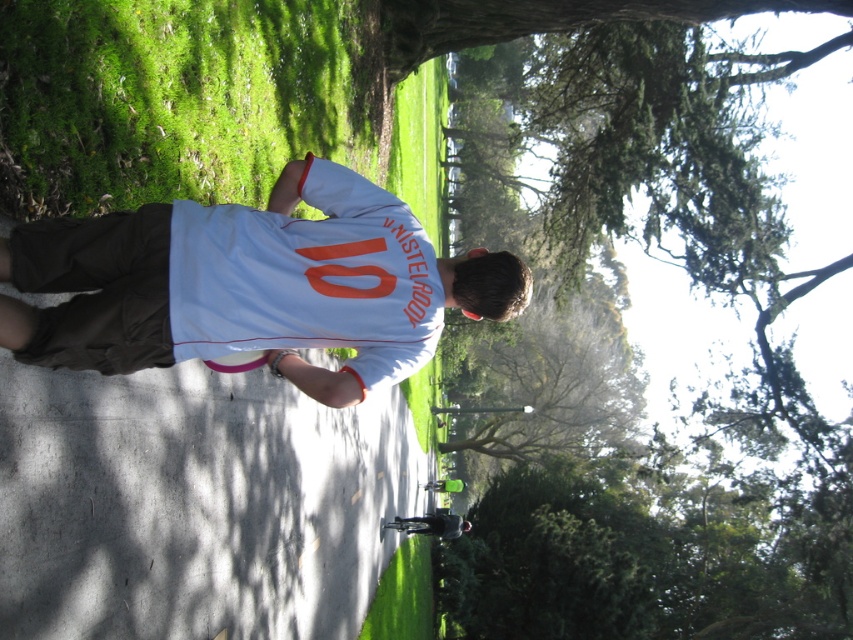
You are a photographer setting up a tripod to take a portrait. The tripod requires a minimum height difference of 10 cm between the surface it stands on and the subject to avoid obstruction. Given the scene described, will the tripod setup work if placed on the white smooth concrete at center with the white matte shirt at center as the subject?

The white smooth concrete at center has a greater height compared to the white matte shirt at center. Since the concrete is higher, the height difference meets the tripod requirement of at least 10 cm, so the setup should work.

You are standing at point (393, 248) and want to walk to the person in the white sports jersey. Is the person in the white sports jersey closer to you or further away than point (625, 513)?

The person in the white sports jersey is closer to you than point (625, 513) because point (625, 513) is behind point (393, 248).

You are planning to take a photo of the person wearing the white sports jersey with orange text. Which object in the scene, the green leafy tree at upper center or the white smooth concrete at center, would make a better backdrop for the photo? Explain your choice based on their sizes.

The green leafy tree at upper center is larger in size than the white smooth concrete at center, making it a better backdrop as it provides a more prominent and visually appealing background for the photo.